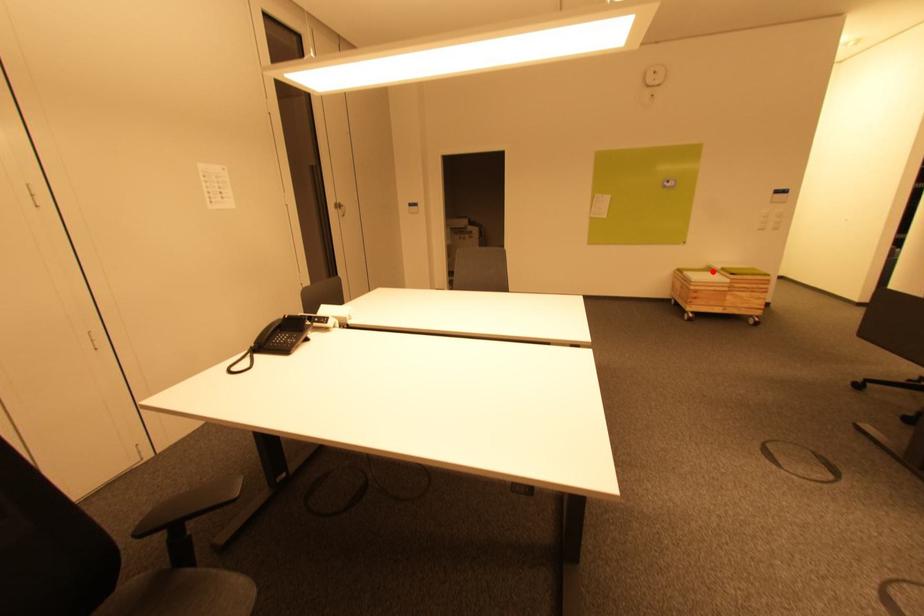
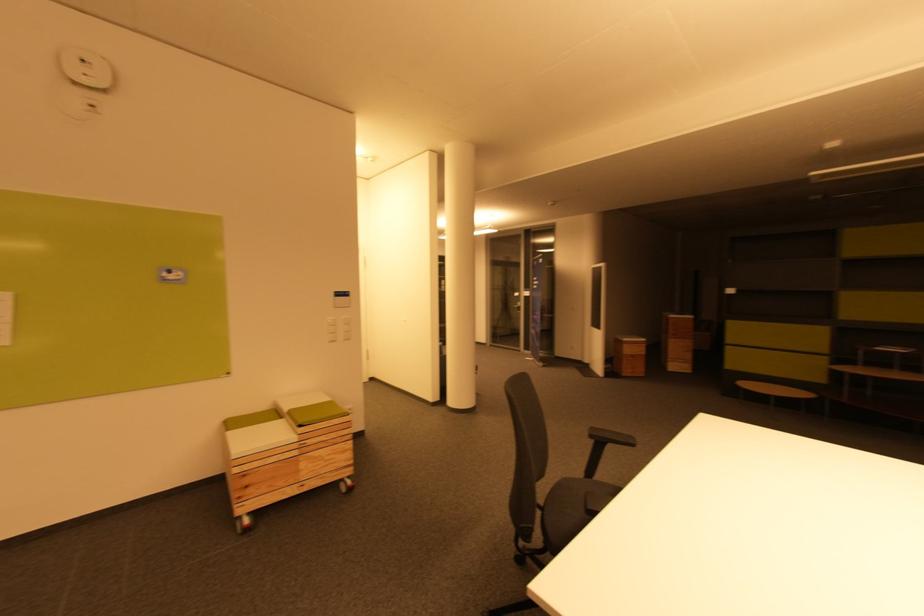
Question: I am providing you with two images of the same scene from different viewpoints. Image1 has a red point marked. In image2, the corresponding 3D location appears at what relative position? Reply with the corresponding letter.

Choices:
 (A) Closer
 (B) Farther

Answer: (B)